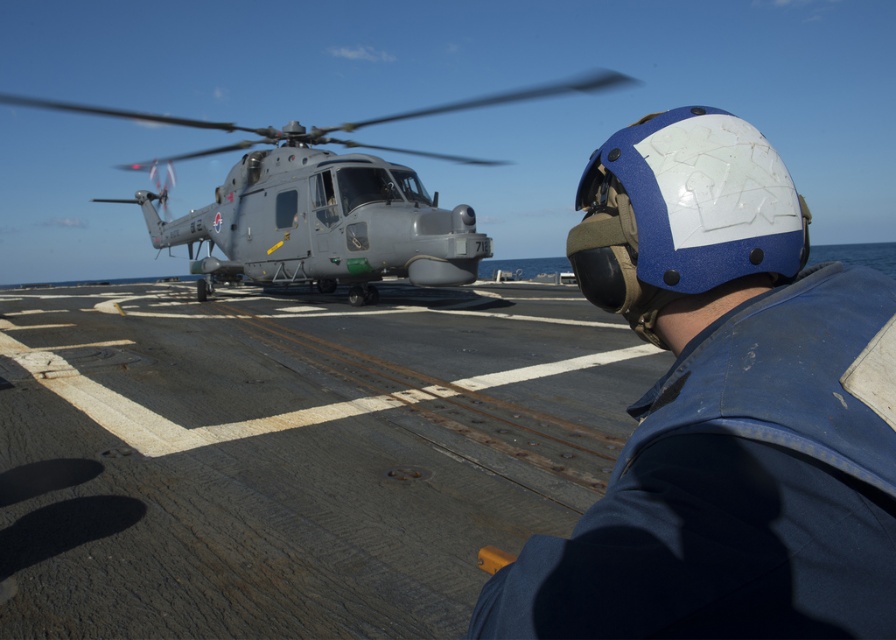
Question: Can you confirm if blue matte helmet at upper right is positioned below gray matte helicopter at center?

Choices:
 (A) no
 (B) yes

Answer: (B)

Question: Which point is farther from the camera taking this photo?

Choices:
 (A) (876, 492)
 (B) (360, 241)

Answer: (B)

Question: Which point is closer to the camera taking this photo?

Choices:
 (A) 770,195
 (B) 366,292

Answer: (A)

Question: Is blue matte helmet at upper right above gray matte helicopter at center?

Choices:
 (A) no
 (B) yes

Answer: (A)

Question: Can you confirm if blue matte helmet at upper right is smaller than gray matte helicopter at center?

Choices:
 (A) yes
 (B) no

Answer: (A)